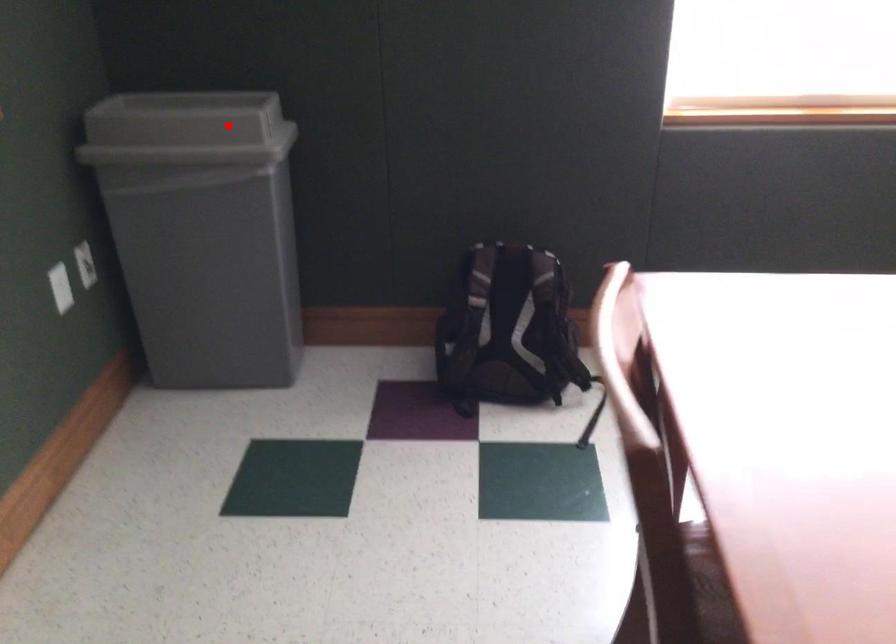
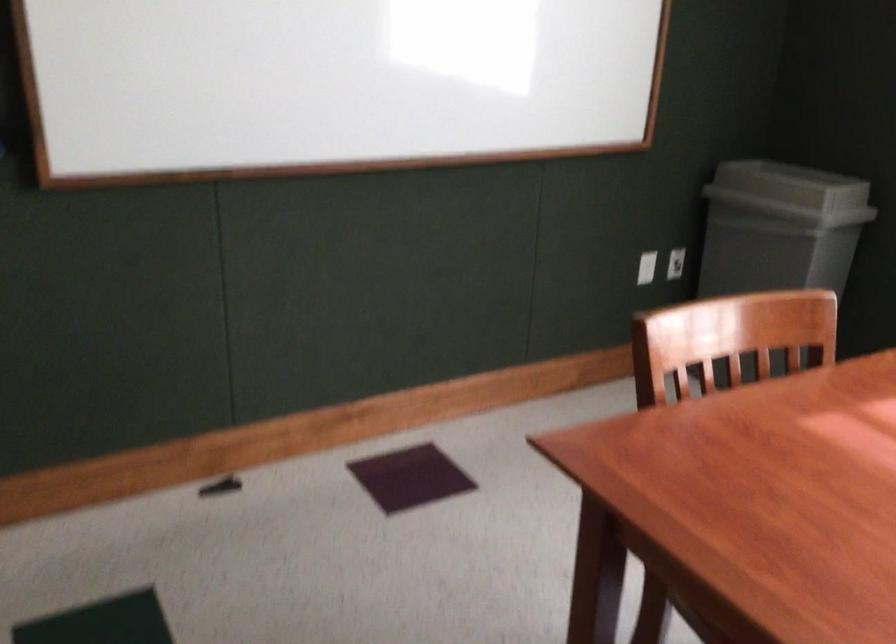
Find the pixel in the second image that matches the highlighted location in the first image.

(791, 185)